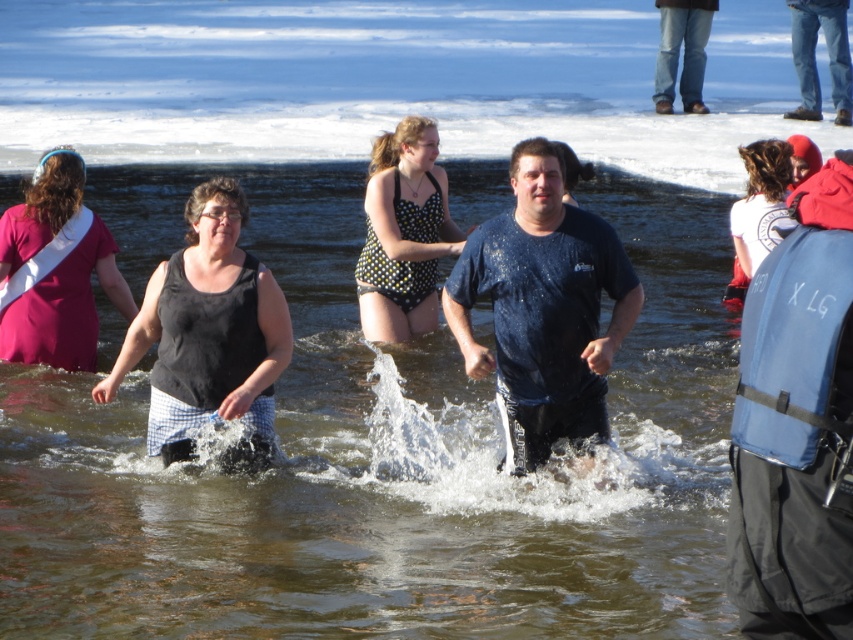
In the polar plunge scene, you see clear water at center and a black matte tank top at center. Which object is positioned to the right of the other?

The clear water at center is to the right of the black matte tank top at center.

You are organizing a photo shoot and need to ensure that the black matte tank top at center and the white cotton shirt at upper right are visible in the final image. Given their sizes, which one might require more strategic positioning to ensure visibility?

The white cotton shirt at upper right is smaller in size than the black matte tank top at center, so it might require more strategic positioning to ensure visibility.

You are a photographer trying to capture the participant in the dark blue t shirt at center. The camera is positioned at point A located at coordinates point A is at (x=543, y=308). Is the dark blue t shirt at center in the same location as point A?

Yes, the point A at (x=543, y=308) marks the dark blue t shirt at center, so they are in the same location.